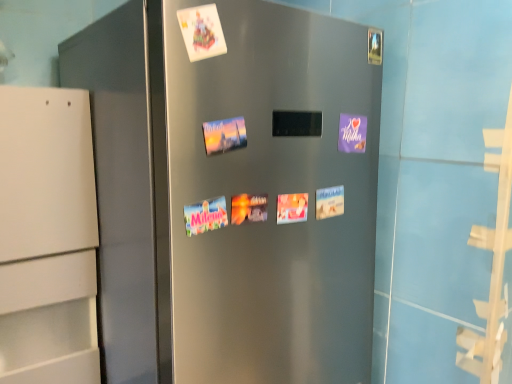
Question: Considering the positions of point (186, 23) and point (330, 195), is point (186, 23) closer or farther from the camera than point (330, 195)?

Choices:
 (A) closer
 (B) farther

Answer: (A)

Question: Is white paper at upper center in front of or behind white paper postcard at center, which is the 2th postcard in top-to-bottom order, in the image?

Choices:
 (A) behind
 (B) front

Answer: (B)

Question: Which is nearer to the white paper at upper center?

Choices:
 (A) purple matte postcard at upper right, the 2th postcard positioned from the bottom
 (B) white paper postcard at center, acting as the 1th postcard starting from the bottom

Answer: (A)

Question: Which of these objects is positioned closest to the white paper at upper center?

Choices:
 (A) purple matte postcard at upper right, arranged as the 1th postcard when viewed from the top
 (B) white paper postcard at center, acting as the 1th postcard starting from the bottom

Answer: (A)